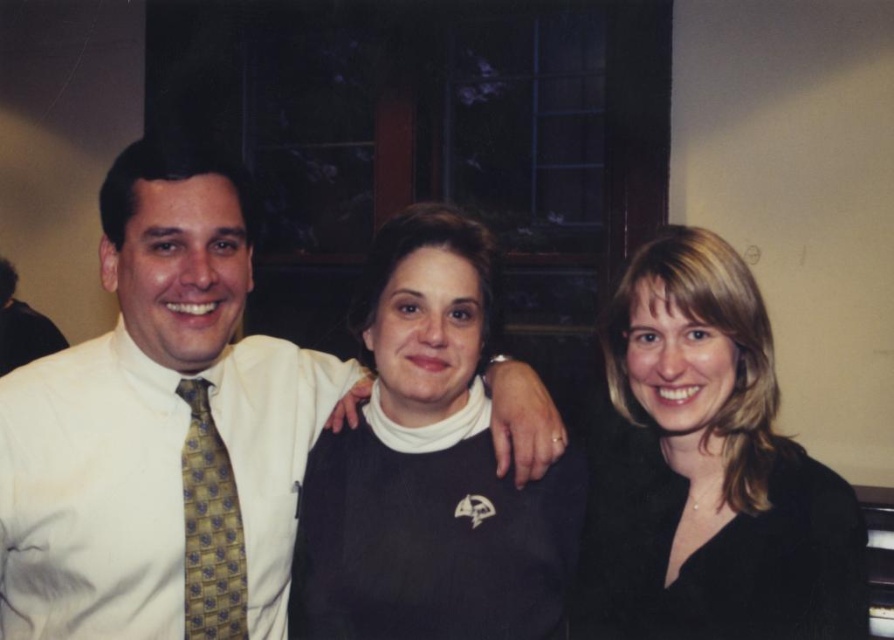
You are organizing a clothing donation drive and need to categorize the black matte sweater at right and the black sweater at center based on their sizes. Which one should be placed in the small size section?

The black matte sweater at right has a smaller size compared to the black sweater at center, so it should be placed in the small size section.

You are a photographer adjusting the lighting for a group photo. The subjects are wearing a black sweater at center and a matte gold tie at left. Since dark clothing can absorb more light, which of these two items might require additional lighting adjustments to ensure proper exposure?

The black sweater at center requires more lighting adjustments because it is bigger than the matte gold tie at left and absorbs more light, making it harder to capture details in darker, larger areas.

Consider the image. You are standing in the room and want to hand a gift to the person wearing the white shirt at left. Based on their position in the image, which direction should you move to approach them?

Since the white shirt at left is positioned at the left side of the image, you should move towards the left to approach the person wearing it.